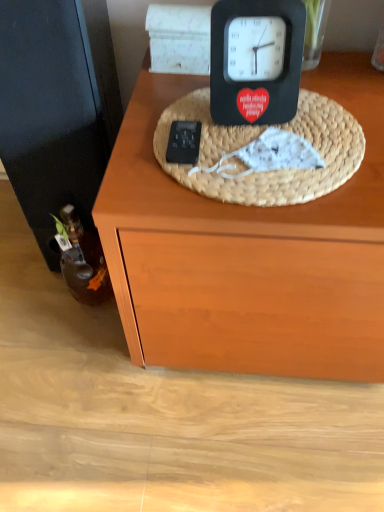
Locate an element on the screen. free point above woven straw basket at center (from a real-world perspective) is located at coordinates (262, 134).